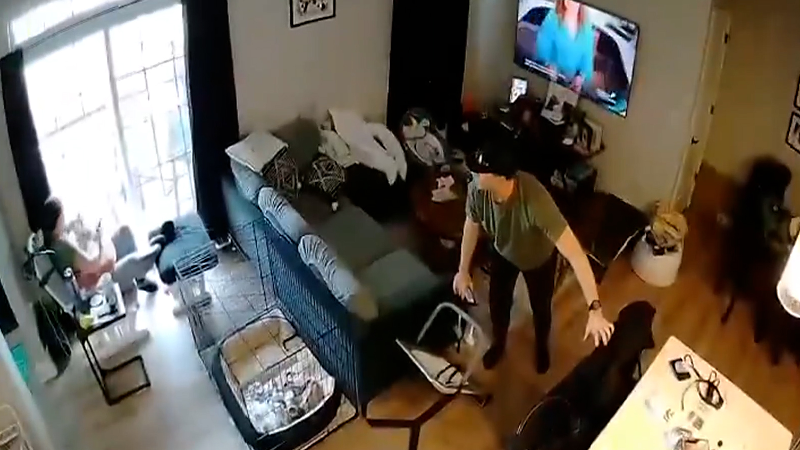
This screenshot has height=450, width=800. I want to click on wall, so click(x=668, y=70).